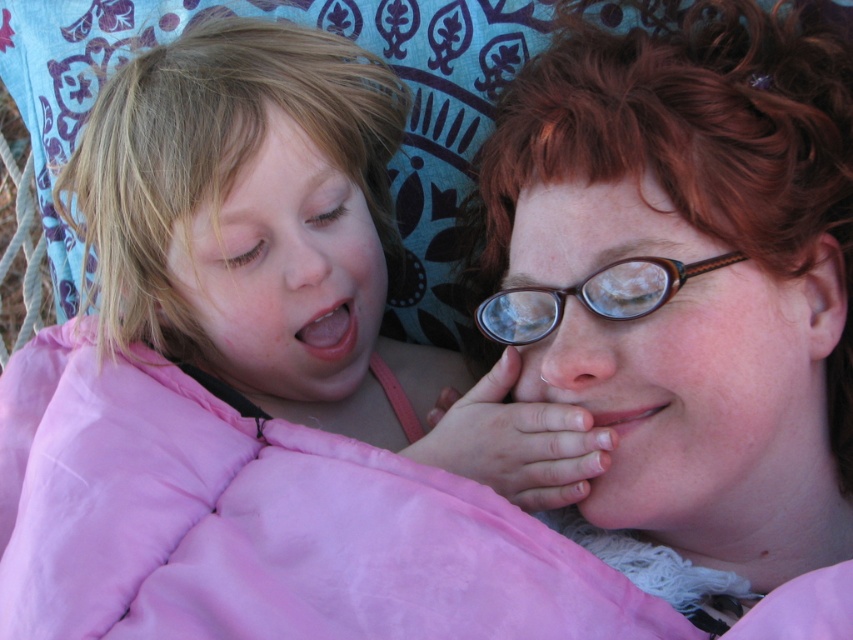
You are taking a photo of two people lying together. You notice two points in the image at coordinates point (566, 337) and point (614, 276). Which point is closer to the camera?

Point (566, 337) is further to the camera than point (614, 276), so the point closer to the camera is point (614, 276).